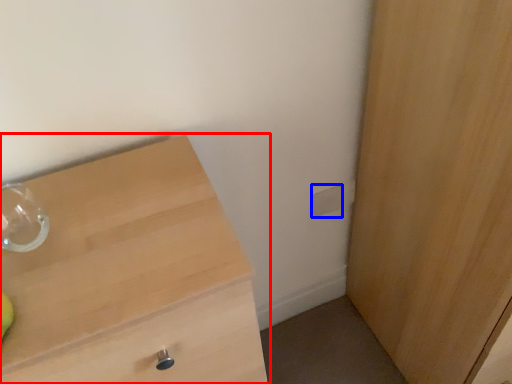
Question: Which object is further to the camera taking this photo, chest of drawers (highlighted by a red box) or electric outlet (highlighted by a blue box)?

Choices:
 (A) chest of drawers
 (B) electric outlet

Answer: (B)